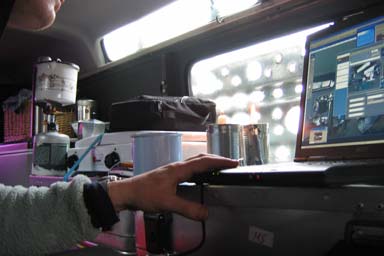
Find the location of a particular element. The height and width of the screenshot is (256, 384). mug is located at coordinates point(161,147).